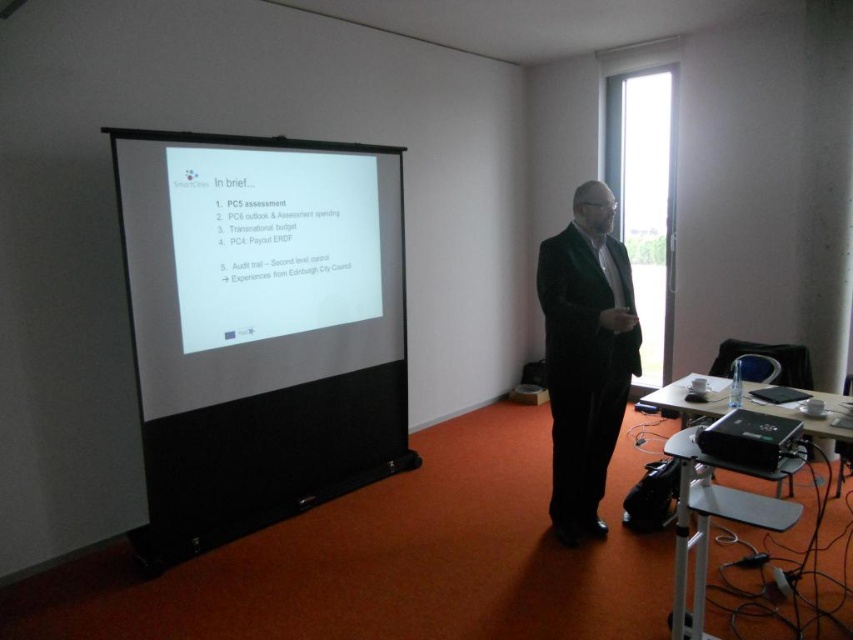
You are an event organizer setting up a presentation room with the given scene. You need to ensure that the white matte projection screen at center and the black plastic projector at lower right are positioned correctly. Based on the scene description, which object is taller?

The white matte projection screen at center is taller than the black plastic projector at lower right according to the description.

You are an attendee at the presentation and want to take a photo of the slide on the white matte projection screen at center. However, you notice someone wearing the velvet black suit at center is blocking your view. Can you see the slide clearly?

The white matte projection screen at center is above the velvet black suit at center, so you can still see the slide clearly as it is positioned above the blocking individual.

You are setting up a presentation in a room with a red carpeted floor. You have a white matte projection screen at center and a black plastic projector at lower right. The projector has a minimum projection distance of 2 meters. Will the projector be able to display the presentation clearly on the screen?

The white matte projection screen at center is 2.19 meters from the black plastic projector at lower right. Since the distance is greater than the projector minimum projection distance of 2 meters, the projector will be able to display the presentation clearly on the screen.